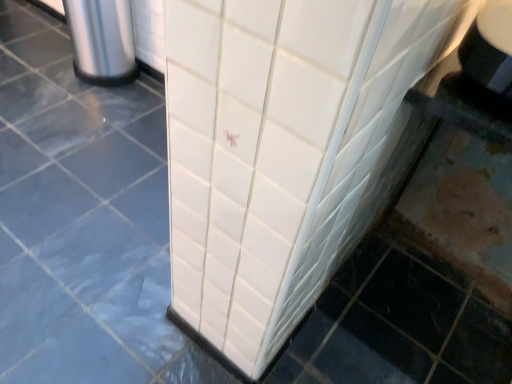
Where is `satin silver trash can at upper left`? satin silver trash can at upper left is located at coordinates (102, 41).

Measure the distance between satin silver trash can at upper left and camera.

satin silver trash can at upper left and camera are 1.83 meters apart.

This screenshot has width=512, height=384. What do you see at coordinates (102, 41) in the screenshot?
I see `satin silver trash can at upper left` at bounding box center [102, 41].

The height and width of the screenshot is (384, 512). What are the coordinates of `satin silver trash can at upper left` in the screenshot? It's located at (102, 41).